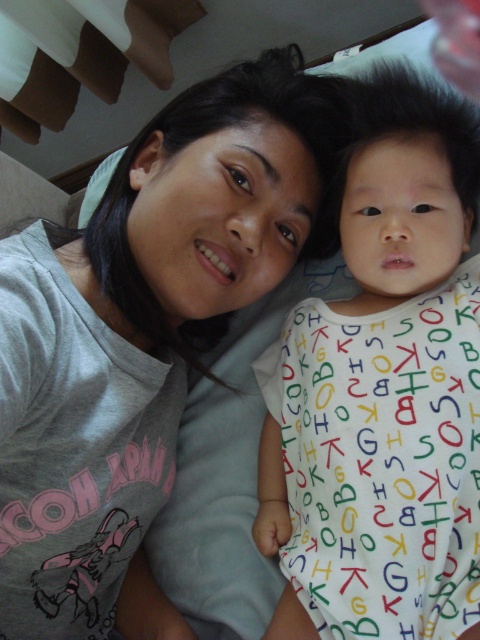
Question: Is gray cotton t-shirt at upper left thinner than white cotton onesie at center?

Choices:
 (A) yes
 (B) no

Answer: (B)

Question: Can you confirm if gray cotton t-shirt at upper left is bigger than white cotton onesie at center?

Choices:
 (A) no
 (B) yes

Answer: (B)

Question: Does gray cotton t-shirt at upper left have a smaller size compared to white cotton onesie at center?

Choices:
 (A) yes
 (B) no

Answer: (B)

Question: Among these objects, which one is nearest to the camera?

Choices:
 (A) white cotton onesie at center
 (B) gray cotton t-shirt at upper left

Answer: (B)